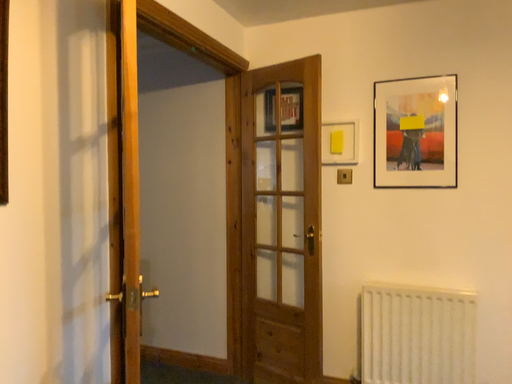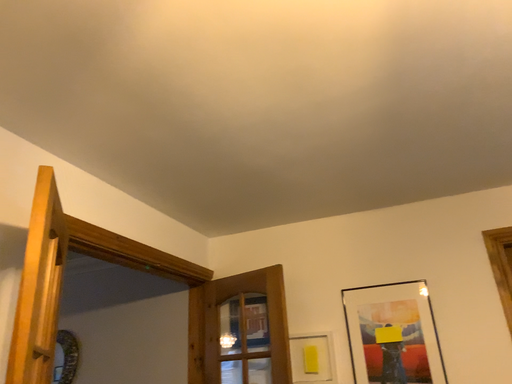
Question: Which way did the camera rotate in the video?

Choices:
 (A) rotated downward
 (B) rotated upward

Answer: (B)